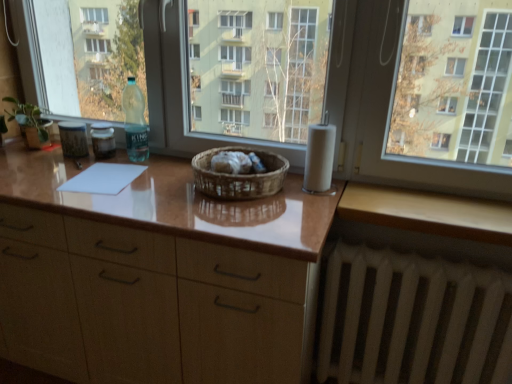
You are a GUI agent. You are given a task and a screenshot of the screen. Output one action in this format:
    pyautogui.click(x=<x>, y=<y>)
    Task: Click on the free area in between woven brown basket at center and translucent plastic bottle at left
    The width and height of the screenshot is (512, 384).
    Given the screenshot: What is the action you would take?
    pyautogui.click(x=150, y=173)